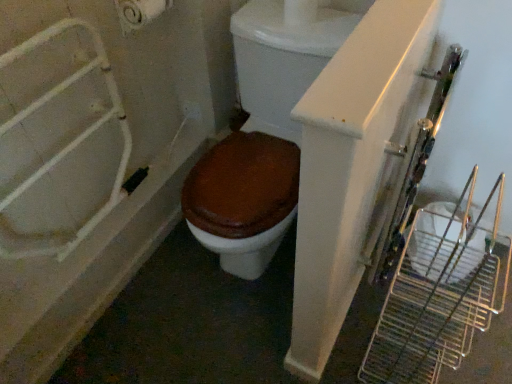
Question: Is white matte toilet paper at upper left inside or outside of white glossy bathtub at left?

Choices:
 (A) outside
 (B) inside

Answer: (A)

Question: From the image's perspective, relative to white glossy bathtub at left, is white matte toilet paper at upper left above or below?

Choices:
 (A) below
 (B) above

Answer: (B)

Question: Which object is positioned closest to the brown matte toilet at center?

Choices:
 (A) white glossy bathtub at left
 (B) white matte toilet paper at upper left

Answer: (A)

Question: Based on their relative distances, which object is nearer to the white glossy bathtub at left?

Choices:
 (A) brown matte toilet at center
 (B) white matte toilet paper at upper left

Answer: (A)